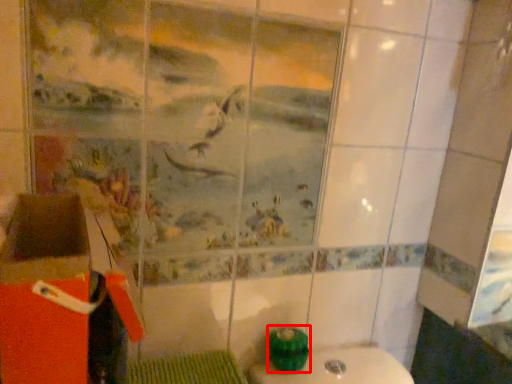
Question: From the image's perspective, where is teal (annotated by the red box) located in relation to cardboard box in the image?

Choices:
 (A) above
 (B) below

Answer: (B)